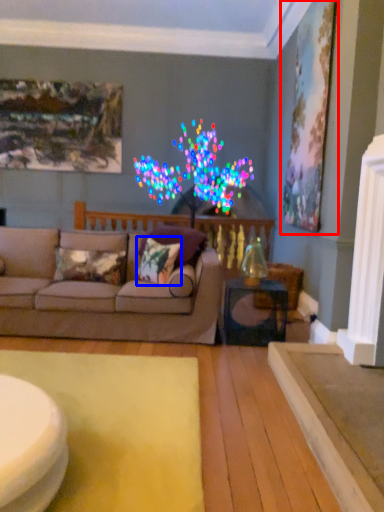
Question: Which object appears closest to the camera in this image, picture frame (highlighted by a red box) or pillow (highlighted by a blue box)?

Choices:
 (A) picture frame
 (B) pillow

Answer: (B)